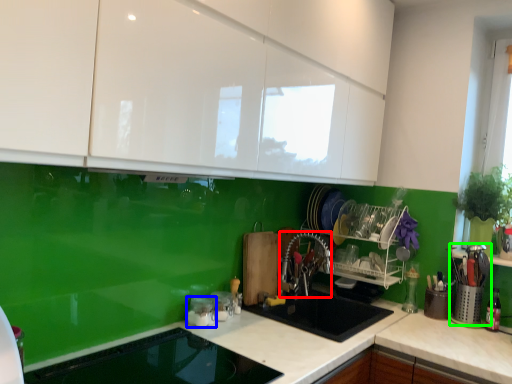
Question: Based on their relative distances, which object is nearer to silverware (highlighted by a red box)? Choose from appliance (highlighted by a blue box) and appliance (highlighted by a green box).

Choices:
 (A) appliance
 (B) appliance

Answer: (A)